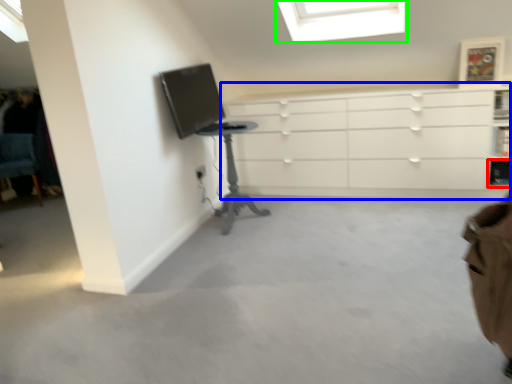
Question: Which object is the farthest from shelf (highlighted by a red box)? Choose among these: chest of drawers (highlighted by a blue box) or window (highlighted by a green box).

Choices:
 (A) chest of drawers
 (B) window

Answer: (B)